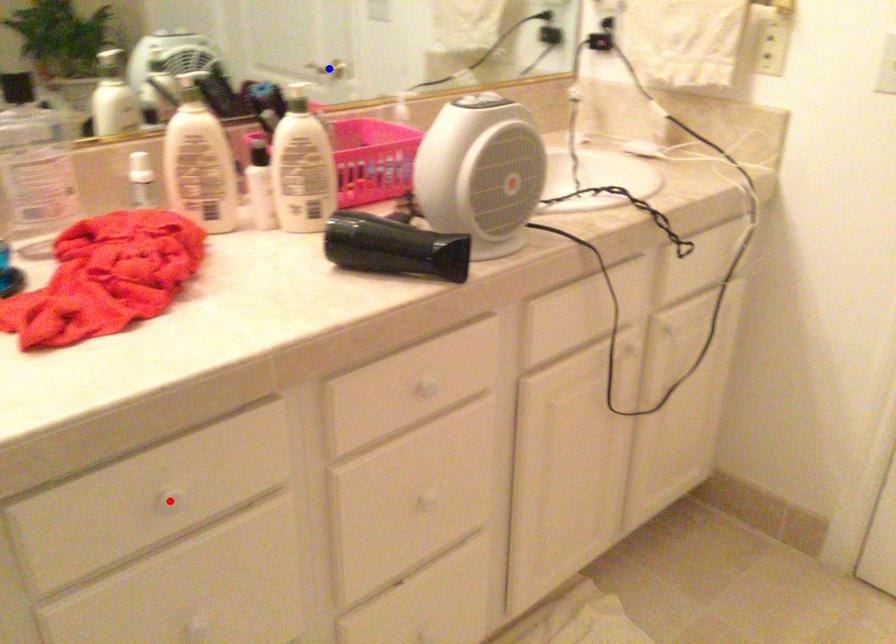
Question: Two points are marked on the image. Which point is closer to the camera?

Choices:
 (A) Blue point is closer.
 (B) Red point is closer.

Answer: (B)